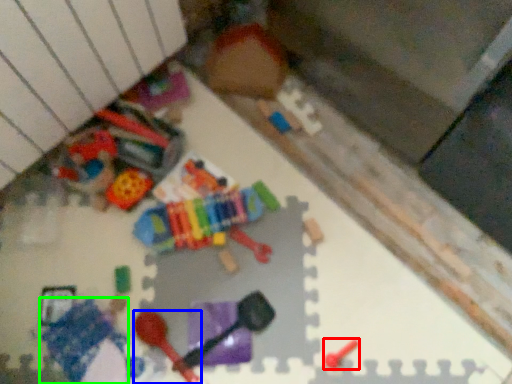
Question: Which is nearer to the toy (highlighted by a red box)? toy (highlighted by a blue box) or toy (highlighted by a green box).

Choices:
 (A) toy
 (B) toy

Answer: (A)